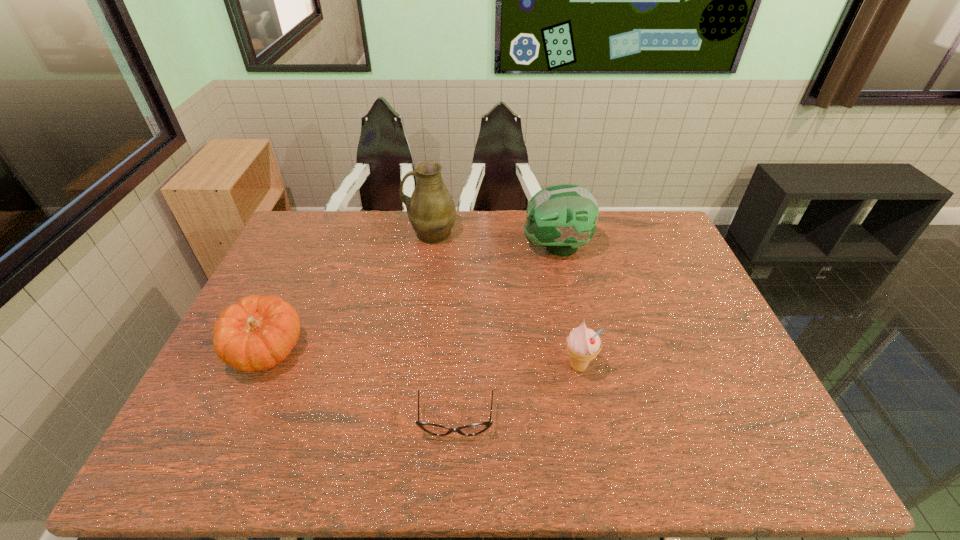
In order to click on free point between the leftmost object and the icecream in this screenshot , I will do `click(422, 359)`.

Locate an element on the screen. free space between the football helmet and the leftmost object is located at coordinates tap(412, 299).

At what (x,y) coordinates should I click in order to perform the action: click on free spot between the icecream and the football helmet. Please return your answer as a coordinate pair (x, y). Looking at the image, I should click on (567, 307).

Locate an element on the screen. This screenshot has width=960, height=540. unoccupied area between the shortest object and the pitcher is located at coordinates (444, 328).

Locate an element on the screen. free spot between the icecream and the pumpkin is located at coordinates (422, 359).

Where is `the second closest object relative to the pitcher`? the second closest object relative to the pitcher is located at coordinates (258, 332).

Identify the location of the fourth closest object to the icecream. (258, 332).

You are a GUI agent. You are given a task and a screenshot of the screen. Output one action in this format:
    pyautogui.click(x=<x>, y=<y>)
    Task: Click on the free region that satisfies the following two spatial constraints: 1. on the back side of the pumpkin; 2. on the handle side of the pitcher
    
    Given the screenshot: What is the action you would take?
    pyautogui.click(x=320, y=234)

The image size is (960, 540). I want to click on free point that satisfies the following two spatial constraints: 1. on the visor of the football helmet; 2. on the front side of the icecream, so click(581, 367).

Find the location of a particular element. The image size is (960, 540). free spot that satisfies the following two spatial constraints: 1. on the visor of the football helmet; 2. on the front-facing side of the nearest object is located at coordinates (592, 421).